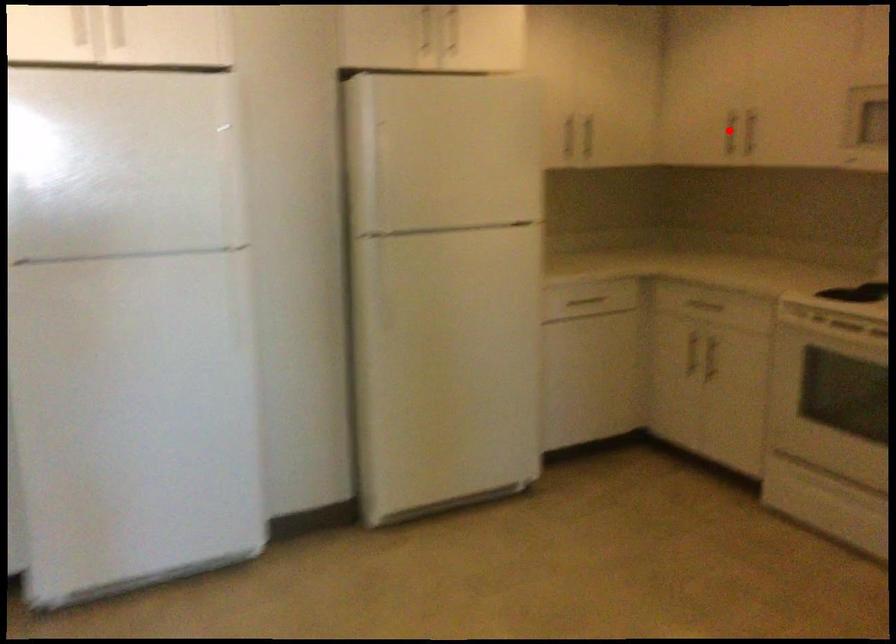
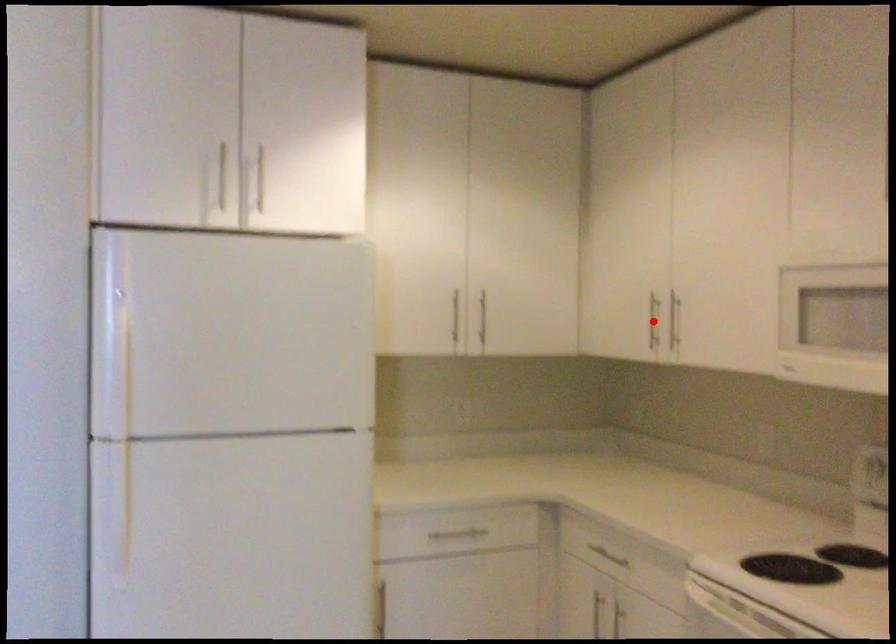
I am providing you with two images of the same scene from different viewpoints. A red point is marked on the first image and another point is marked on the second image. Is the marked point in image1 the same physical position as the marked point in image2?

Yes